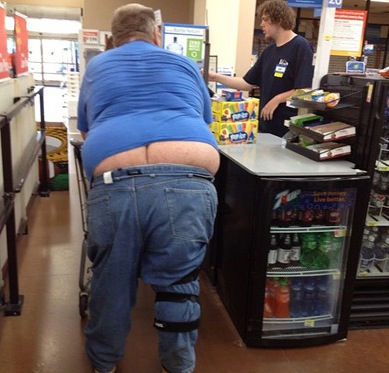
This screenshot has height=373, width=389. Identify the location of door. (57, 49), (36, 52).